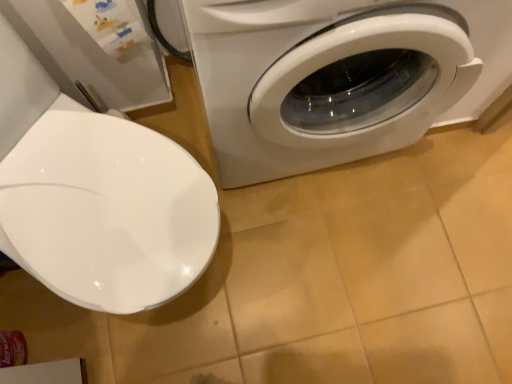
Find the location of a particular element. The width and height of the screenshot is (512, 384). white glossy toilet seat at left is located at coordinates (106, 211).

What do you see at coordinates (106, 211) in the screenshot? I see `white glossy toilet seat at left` at bounding box center [106, 211].

What is the approximate height of white glossy toilet seat at left?

white glossy toilet seat at left is 28.88 inches tall.

You are a GUI agent. You are given a task and a screenshot of the screen. Output one action in this format:
    pyautogui.click(x=<x>, y=<y>)
    Task: Click on the white glossy washing machine at right
    The image size is (512, 384).
    Given the screenshot: What is the action you would take?
    pyautogui.click(x=323, y=79)

What is the approximate width of white glossy washing machine at right?

19.92 inches.

The height and width of the screenshot is (384, 512). Describe the element at coordinates (323, 79) in the screenshot. I see `white glossy washing machine at right` at that location.

This screenshot has width=512, height=384. Find the location of `white glossy toilet seat at left`. white glossy toilet seat at left is located at coordinates (106, 211).

Based on their positions, is white glossy washing machine at right located to the left or right of white glossy toilet seat at left?

white glossy washing machine at right is to the right of white glossy toilet seat at left.

Which object is further away from the camera taking this photo, white glossy washing machine at right or white glossy toilet seat at left?

white glossy washing machine at right is further from the camera.

Considering the positions of point (404, 75) and point (27, 207), is point (404, 75) closer or farther from the camera than point (27, 207)?

Point (404, 75).

From the image's perspective, relative to white glossy toilet seat at left, is white glossy washing machine at right above or below?

white glossy washing machine at right is above white glossy toilet seat at left.

From a real-world perspective, is white glossy washing machine at right physically located above or below white glossy toilet seat at left?

white glossy washing machine at right is above white glossy toilet seat at left.

Does white glossy washing machine at right have a greater width compared to white glossy toilet seat at left?

No, white glossy washing machine at right is not wider than white glossy toilet seat at left.

In terms of height, does white glossy washing machine at right look taller or shorter compared to white glossy toilet seat at left?

Clearly, white glossy washing machine at right is taller compared to white glossy toilet seat at left.

Considering the sizes of white glossy washing machine at right and white glossy toilet seat at left in the image, is white glossy washing machine at right bigger or smaller than white glossy toilet seat at left?

Clearly, white glossy washing machine at right is larger in size than white glossy toilet seat at left.

From the picture: Could white glossy toilet seat at left be considered to be inside white glossy washing machine at right?

No, white glossy toilet seat at left is not a part of white glossy washing machine at right.

Would you say white glossy washing machine at right is a long distance from white glossy toilet seat at left?

They are positioned close to each other.

Does white glossy washing machine at right turn towards white glossy toilet seat at left?

No, white glossy washing machine at right does not turn towards white glossy toilet seat at left.

I want to click on washing machine behind the white glossy toilet seat at left, so click(x=323, y=79).

Considering the positions of objects white glossy toilet seat at left and white glossy washing machine at right in the image provided, who is more to the left, white glossy toilet seat at left or white glossy washing machine at right?

white glossy toilet seat at left.

Is white glossy toilet seat at left in front of white glossy washing machine at right?

Yes.

Considering the points (96, 188) and (349, 127), which point is behind, point (96, 188) or point (349, 127)?

The point (349, 127) is farther.

From the image's perspective, is white glossy toilet seat at left beneath white glossy washing machine at right?

Indeed, from the image's perspective, white glossy toilet seat at left is shown beneath white glossy washing machine at right.

From a real-world perspective, is white glossy toilet seat at left on white glossy washing machine at right?

Incorrect, from a real-world perspective, white glossy toilet seat at left is lower than white glossy washing machine at right.

Which object is thinner, white glossy toilet seat at left or white glossy washing machine at right?

white glossy washing machine at right.

Considering the sizes of objects white glossy toilet seat at left and white glossy washing machine at right in the image provided, who is taller, white glossy toilet seat at left or white glossy washing machine at right?

white glossy washing machine at right.

Which of these two, white glossy toilet seat at left or white glossy washing machine at right, is bigger?

white glossy washing machine at right.

Is white glossy toilet seat at left inside or outside of white glossy washing machine at right?

The correct answer is: outside.

Is white glossy toilet seat at left not close to white glossy washing machine at right?

That's not correct — white glossy toilet seat at left is a little close to white glossy washing machine at right.

Does white glossy toilet seat at left turn towards white glossy washing machine at right?

No, white glossy toilet seat at left is not aimed at white glossy washing machine at right.

Measure the distance from white glossy toilet seat at left to white glossy washing machine at right.

They are 32.13 centimeters apart.

Identify the location of toilet below the white glossy washing machine at right (from the image's perspective). (106, 211).

You are a GUI agent. You are given a task and a screenshot of the screen. Output one action in this format:
    pyautogui.click(x=<x>, y=<y>)
    Task: Click on the toilet on the left of the white glossy washing machine at right
    This screenshot has height=384, width=512.
    Given the screenshot: What is the action you would take?
    pyautogui.click(x=106, y=211)

You are a GUI agent. You are given a task and a screenshot of the screen. Output one action in this format:
    pyautogui.click(x=<x>, y=<y>)
    Task: Click on the washing machine to the right of white glossy toilet seat at left
    This screenshot has height=384, width=512.
    Given the screenshot: What is the action you would take?
    pyautogui.click(x=323, y=79)